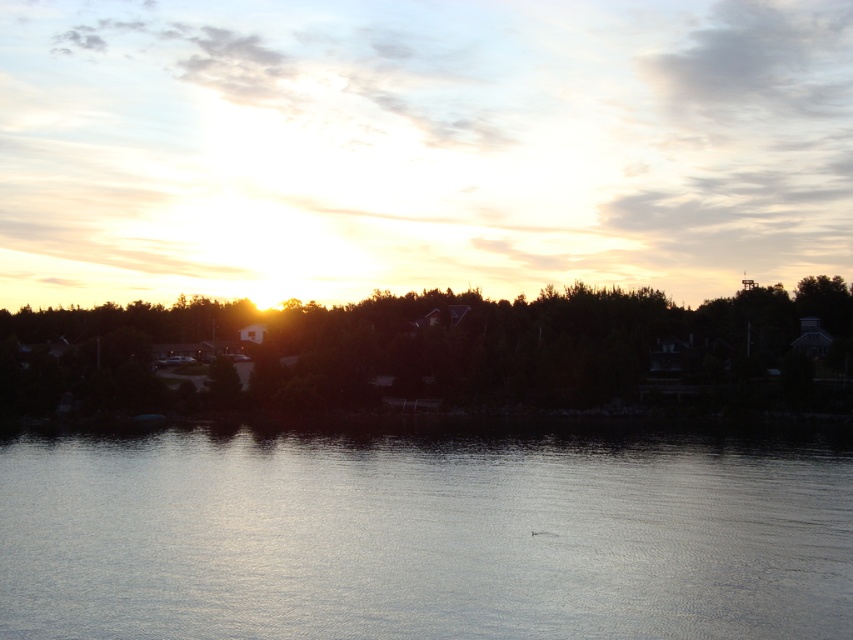
You are standing at the edge of the water and want to locate the silvery reflective water at center. According to the coordinates provided, in which direction should you look relative to your position?

The silvery reflective water at center is located at coordinates point (422, 536). Since the coordinates are given as x,y values between 0 and 1, with (0, 0) being the bottom left corner, you should look towards the upper right direction from your position at the edge.

You are an artist trying to paint the sunset scene. You notice the silvery reflective water at center and the dark green leafy trees at center. Which object should you paint first if you want to focus on the larger element in the scene?

The dark green leafy trees at center should be painted first because they are larger than the silvery reflective water at center.

You are standing at the edge of the water and want to reach the dark green leafy trees at center. Which direction should you move to get closer to them without crossing the silvery reflective water at center?

You should move away from the silvery reflective water at center because it is closer to you than the dark green leafy trees at center, so moving away from the water would bring you closer to the trees.